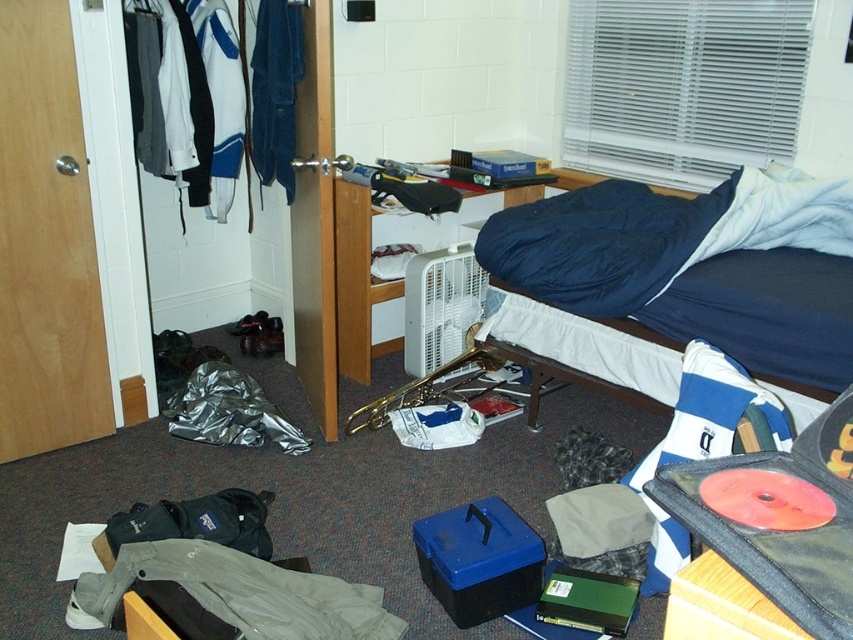
You are a delivery person trying to navigate through the cluttered dorm room. You need to deliver a package to the bed on the right side. There are two jackets in your way. The khaki cotton jacket at lower left and the blue fabric jacket at left. Can you walk between them without moving any items?

The distance between the khaki cotton jacket at lower left and the blue fabric jacket at left is 1.65 meters. Since the average person requires about 0.7 meters to pass through, you can walk between them without moving any items.

You are standing in the middle of the room and want to move towards the door. Which direction should you walk to avoid the dark blue fabric bed at upper right and blue fabric jacket at left?

Since the dark blue fabric bed at upper right is to the right of the blue fabric jacket at left, you should walk towards the left side of the room to avoid both objects and reach the door.

You are standing in the middle of the room and want to pick up an item from the floor. Which direction should you move to reach the point marked by the coordinates point at point (239, 96)?

The point marked by the coordinates point at point (239, 96) is located at the left side of the room, so you should move towards the left to reach it.